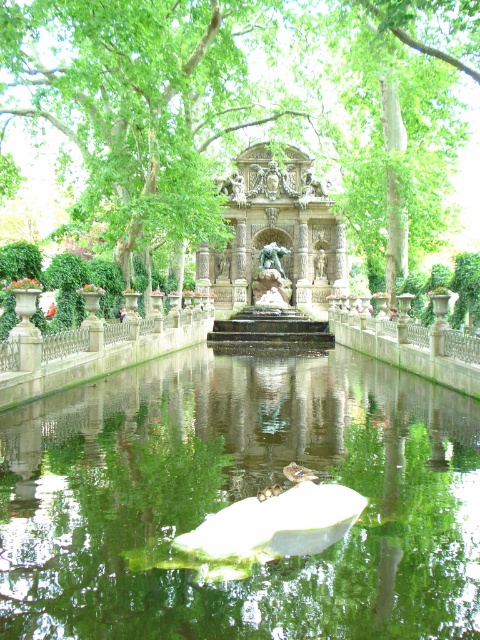
Is bronze statue at center wider than polished bronze statue at center?

Yes.

Based on the photo, does bronze statue at center have a smaller size compared to polished bronze statue at center?

Actually, bronze statue at center might be larger than polished bronze statue at center.

Looking at this image, who is more forward, (288, 342) or (319, 256)?

Point (288, 342) is more forward.

This screenshot has height=640, width=480. I want to click on bronze statue at center, so click(x=269, y=316).

Between bronze sculpture at center and polished bronze statue at center, which one has more height?

bronze sculpture at center

Who is more forward, (225, 300) or (325, 259)?

Point (225, 300) is more forward.

Is point (279, 193) closer to camera compared to point (319, 253)?

No, it is behind (319, 253).

Image resolution: width=480 pixels, height=640 pixels. In order to click on bronze sculpture at center in this screenshot , I will do `click(275, 230)`.

Which is behind, point (321, 216) or point (269, 330)?

Point (321, 216)

Is bronze sculpture at center behind bronze statue at center?

Yes, bronze sculpture at center is behind bronze statue at center.

Which is behind, point (222, 180) or point (256, 275)?

Positioned behind is point (222, 180).

Where is `bronze sculpture at center`? The image size is (480, 640). bronze sculpture at center is located at coordinates (275, 230).